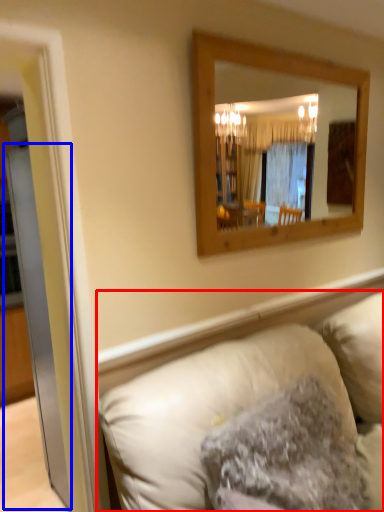
Question: Which object is closer to the camera taking this photo, studio couch (highlighted by a red box) or glass door (highlighted by a blue box)?

Choices:
 (A) studio couch
 (B) glass door

Answer: (A)